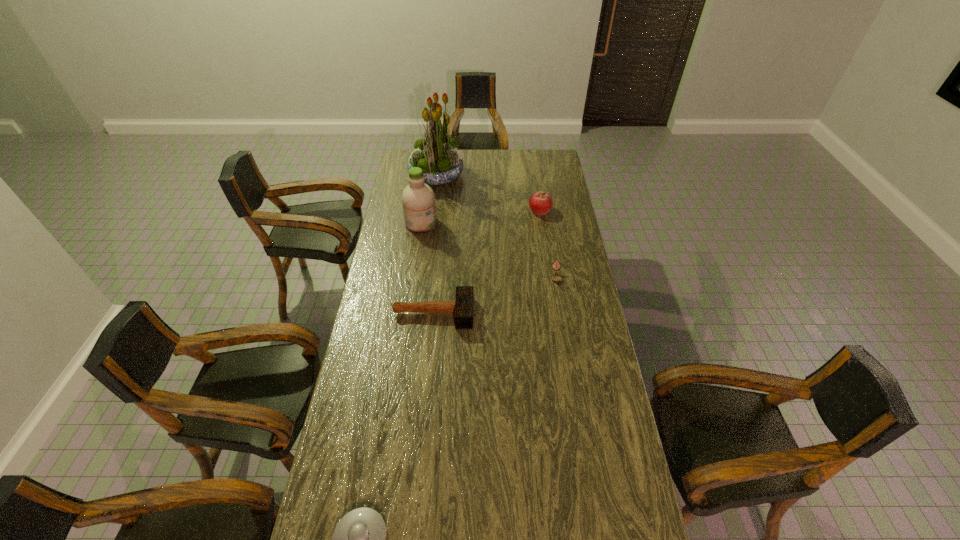
Identify the location of free point between the fifth farthest object and the flower arrangement. Image resolution: width=960 pixels, height=540 pixels. (435, 244).

This screenshot has width=960, height=540. Find the location of `free spot between the compass and the flower arrangement`. free spot between the compass and the flower arrangement is located at coordinates (496, 226).

Where is `the fifth closest object to the fourth farthest object`? the fifth closest object to the fourth farthest object is located at coordinates (359, 539).

Locate which object is the fifth closest to the fourth farthest object. Please provide its 2D coordinates. Your answer should be formatted as a tuple, i.e. [(x, y)], where the tuple contains the x and y coordinates of a point satisfying the conditions above.

[(359, 539)]